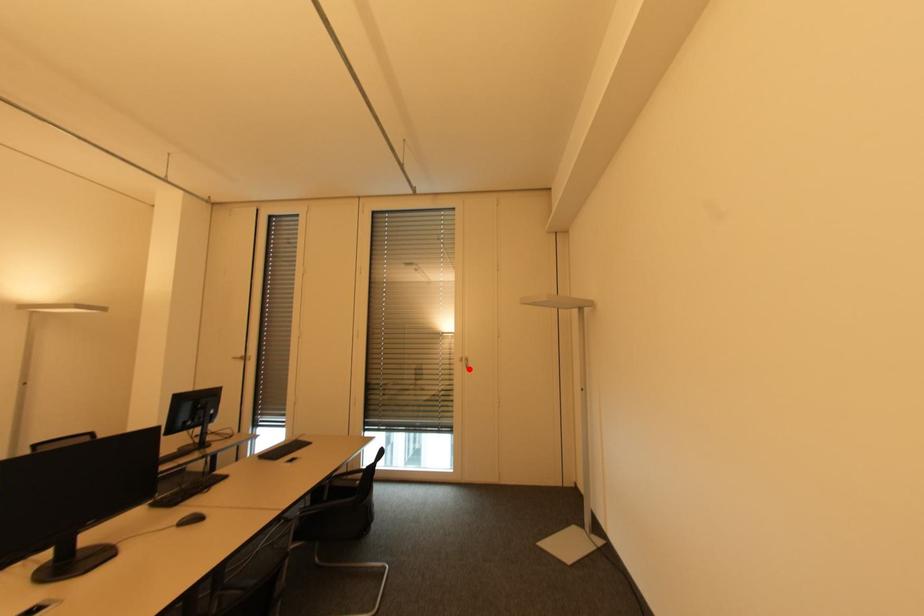
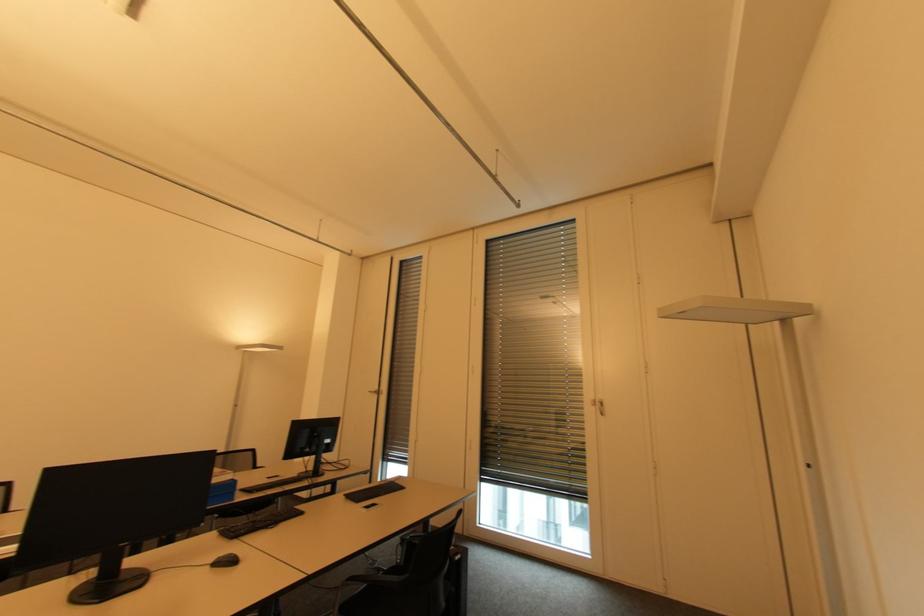
Question: I am providing you with two images of the same scene from different viewpoints. A red point is marked on the first image. Is the red point's position out of view in image 2?

Choices:
 (A) Yes
 (B) No

Answer: (B)